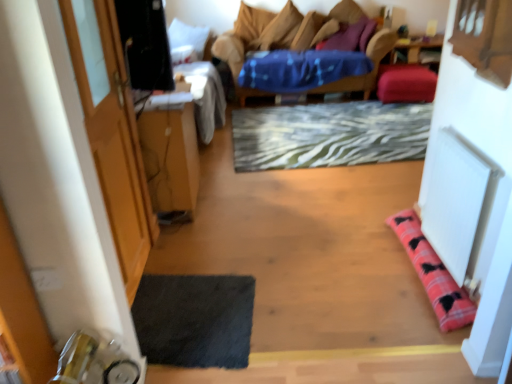
Question: Considering the relative sizes of dark gray textured yoga mat at lower left and pink plaid pillow at lower right, acting as the 1th pillow starting from the bottom, in the image provided, is dark gray textured yoga mat at lower left taller than pink plaid pillow at lower right, acting as the 1th pillow starting from the bottom,?

Choices:
 (A) yes
 (B) no

Answer: (B)

Question: From a real-world perspective, does dark gray textured yoga mat at lower left sit lower than pink plaid pillow at lower right, which is counted as the fourth pillow, starting from the top?

Choices:
 (A) yes
 (B) no

Answer: (A)

Question: Does dark gray textured yoga mat at lower left appear on the right side of pink plaid pillow at lower right, the 3th pillow positioned from the right?

Choices:
 (A) no
 (B) yes

Answer: (A)

Question: Can you confirm if dark gray textured yoga mat at lower left is shorter than pink plaid pillow at lower right, which is counted as the fourth pillow, starting from the top?

Choices:
 (A) yes
 (B) no

Answer: (A)

Question: Is dark gray textured yoga mat at lower left facing towards pink plaid pillow at lower right, acting as the 1th pillow starting from the bottom?

Choices:
 (A) yes
 (B) no

Answer: (A)

Question: Is point (411, 94) closer or farther from the camera than point (436, 302)?

Choices:
 (A) farther
 (B) closer

Answer: (A)

Question: Based on their positions, is velvet pink cushion at upper right, which appears as the 2th pillow when ordered from the bottom, located to the left or right of pink plaid pillow at lower right, which is counted as the first pillow, starting from the front?

Choices:
 (A) right
 (B) left

Answer: (A)

Question: From a real-world perspective, is velvet pink cushion at upper right, which appears as the 2th pillow when ordered from the bottom, positioned above or below pink plaid pillow at lower right, which is counted as the fourth pillow, starting from the top?

Choices:
 (A) below
 (B) above

Answer: (B)

Question: From the image's perspective, is velvet pink cushion at upper right, the 1th pillow in the back-to-front sequence, positioned above or below pink plaid pillow at lower right, the 3th pillow positioned from the right?

Choices:
 (A) above
 (B) below

Answer: (A)

Question: Considering the positions of zebra-patterned rug at center and pink plaid pillow at lower right, acting as the 1th pillow starting from the bottom, in the image, is zebra-patterned rug at center taller or shorter than pink plaid pillow at lower right, acting as the 1th pillow starting from the bottom,?

Choices:
 (A) short
 (B) tall

Answer: (A)

Question: Is zebra-patterned rug at center bigger or smaller than pink plaid pillow at lower right, the 3th pillow positioned from the right?

Choices:
 (A) small
 (B) big

Answer: (B)

Question: Considering the positions of zebra-patterned rug at center and pink plaid pillow at lower right, which is counted as the first pillow, starting from the front, in the image, is zebra-patterned rug at center wider or thinner than pink plaid pillow at lower right, which is counted as the first pillow, starting from the front,?

Choices:
 (A) wide
 (B) thin

Answer: (A)

Question: Considering their positions, is zebra-patterned rug at center located in front of or behind pink plaid pillow at lower right, which is counted as the fourth pillow, starting from the top?

Choices:
 (A) front
 (B) behind

Answer: (B)

Question: Is purple soft pillow at upper center, which is the third pillow from front to back, inside or outside of wooden table at left?

Choices:
 (A) inside
 (B) outside

Answer: (B)

Question: From the image's perspective, is purple soft pillow at upper center, acting as the second pillow starting from the back, located above or below wooden table at left?

Choices:
 (A) above
 (B) below

Answer: (A)